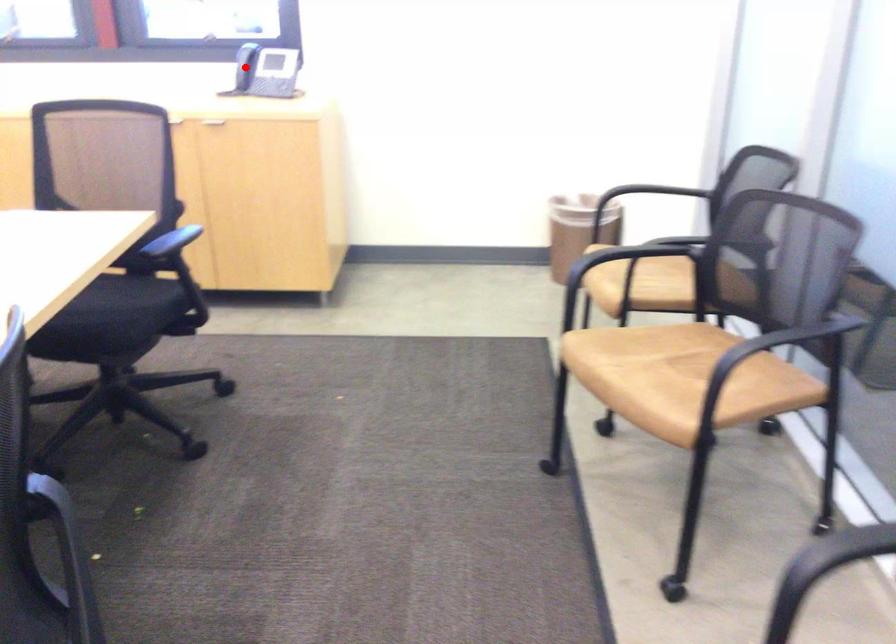
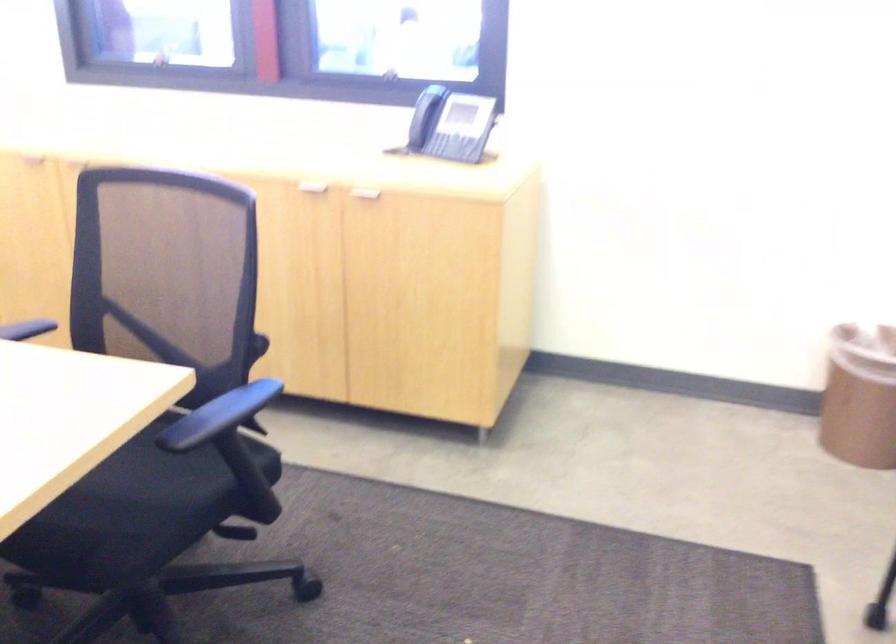
Question: I am providing you with two images of the same scene from different viewpoints. A red point is marked on the first image. At the location where the point appears in image 1, is it still visible in image 2?

Choices:
 (A) Yes
 (B) No

Answer: (A)